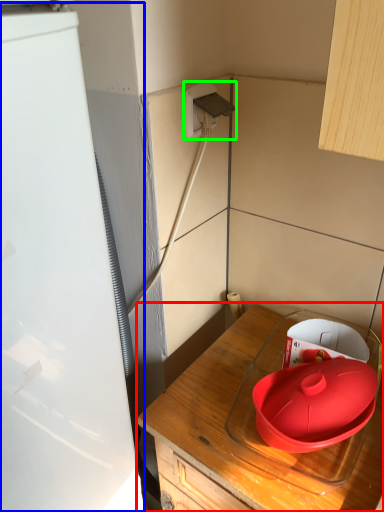
Question: Based on their relative distances, which object is farther from countertop (highlighted by a red box)? Choose from appliance (highlighted by a blue box) and electric outlet (highlighted by a green box).

Choices:
 (A) appliance
 (B) electric outlet

Answer: (B)